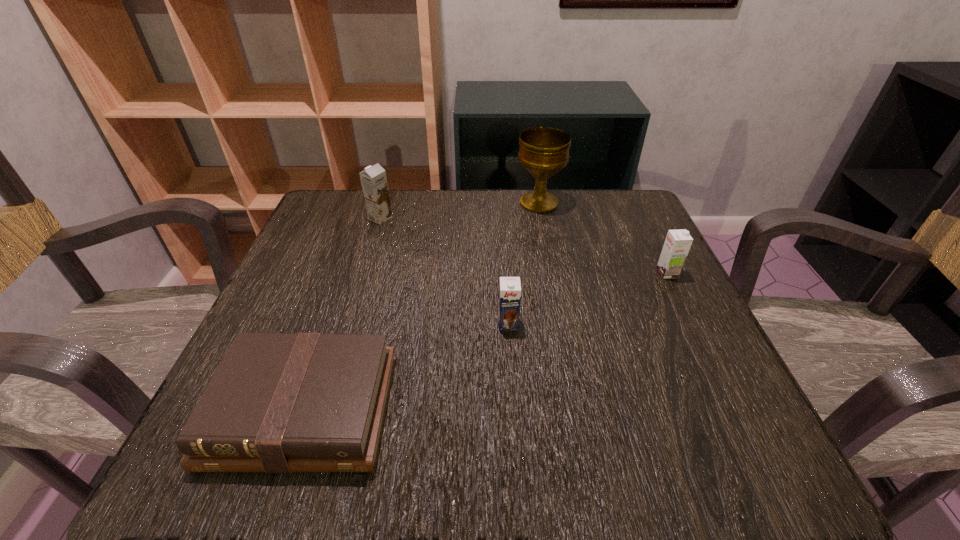
Locate which object is the fourth closest to the rightmost object. Please provide its 2D coordinates. Your answer should be formatted as a tuple, i.e. [(x, y)], where the tuple contains the x and y coordinates of a point satisfying the conditions above.

[(373, 179)]

The image size is (960, 540). Identify the location of chocolate milk that stands as the closest to the leftmost chocolate milk. (510, 288).

Where is `the third closest chocolate milk to the nearest object`? This screenshot has width=960, height=540. the third closest chocolate milk to the nearest object is located at coordinates (678, 242).